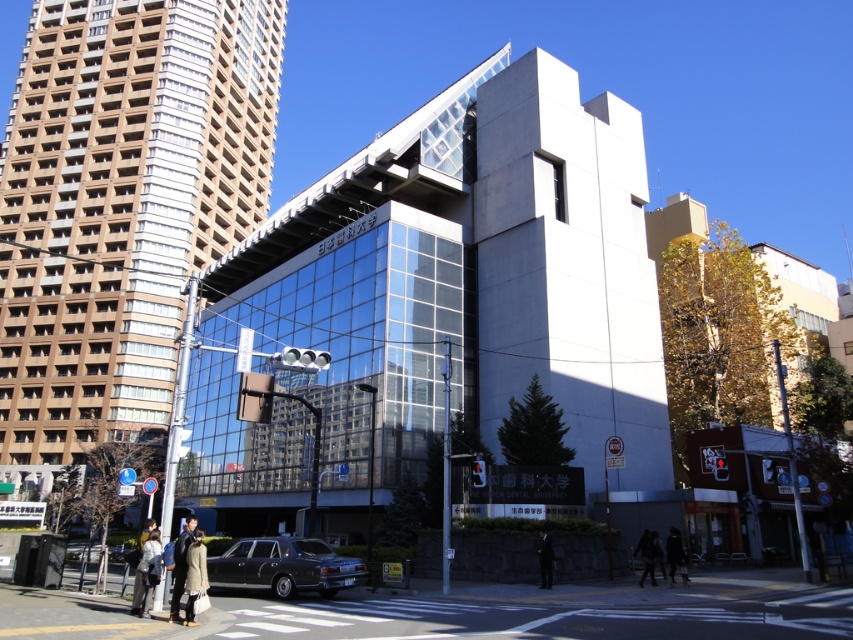
Between matte gray coat at lower center and dark gray coat at lower right, which one appears on the left side from the viewer's perspective?

From the viewer's perspective, matte gray coat at lower center appears more on the left side.

From the picture: Can you confirm if matte gray coat at lower center is smaller than dark gray coat at lower right?

Indeed, matte gray coat at lower center has a smaller size compared to dark gray coat at lower right.

Which is in front, point (186, 605) or point (656, 540)?

Point (186, 605) is more forward.

The height and width of the screenshot is (640, 853). I want to click on matte gray coat at lower center, so click(x=194, y=576).

Who is lower down, shiny black sedan at lower center or dark gray coat at lower center?

dark gray coat at lower center

Between shiny black sedan at lower center and dark gray coat at lower center, which one appears on the left side from the viewer's perspective?

shiny black sedan at lower center is more to the left.

Between point (274, 545) and point (648, 557), which one is positioned behind?

Positioned behind is point (648, 557).

Locate an element on the screen. shiny black sedan at lower center is located at coordinates (283, 566).

Is dark gray coat at lower center to the right of dark gray coat at lower right from the viewer's perspective?

In fact, dark gray coat at lower center is to the left of dark gray coat at lower right.

Which of these two, dark gray coat at lower center or dark gray coat at lower right, stands taller?

With more height is dark gray coat at lower right.

Which is behind, point (647, 566) or point (651, 540)?

The point (651, 540) is behind.

This screenshot has width=853, height=640. In order to click on dark gray coat at lower center in this screenshot , I will do `click(646, 556)`.